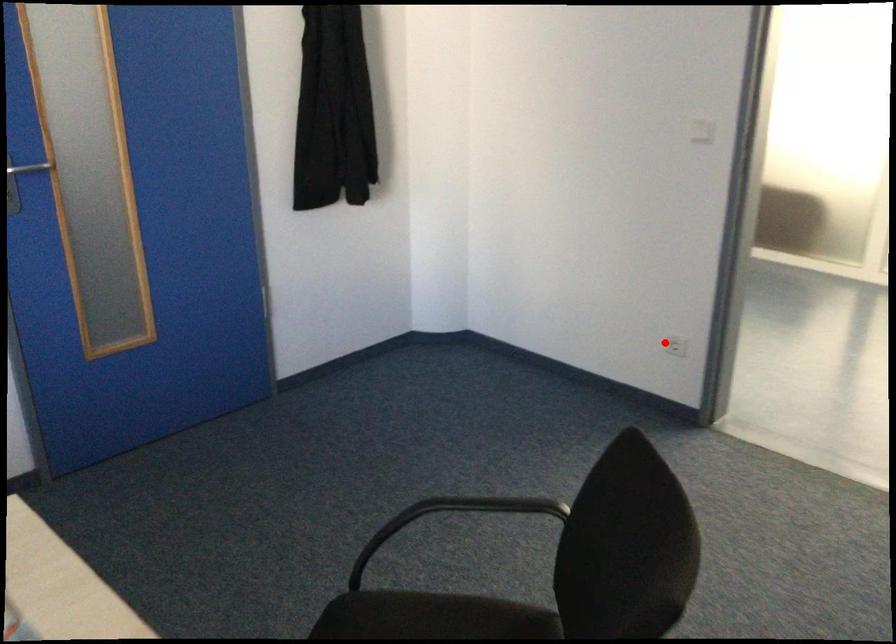
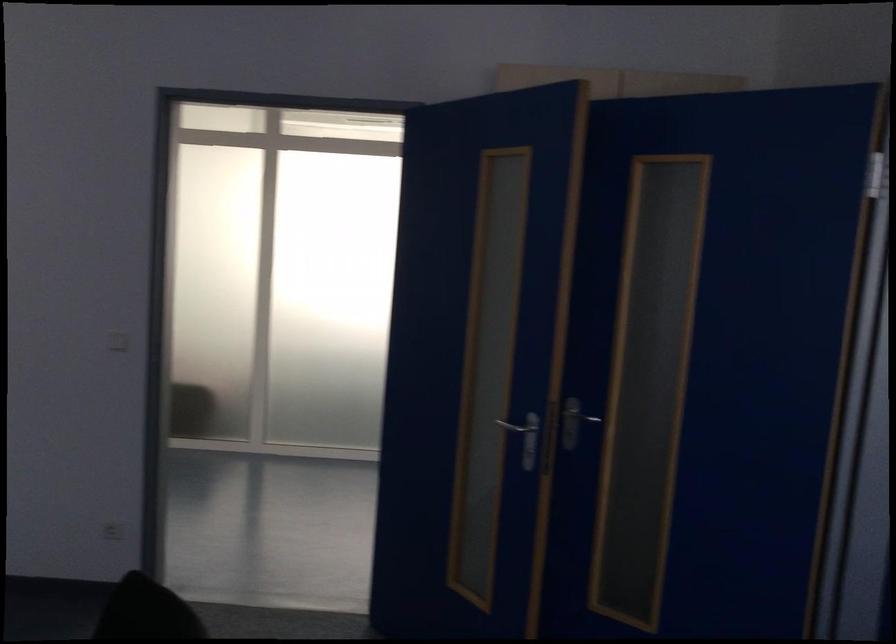
The point at the highlighted location is marked in the first image. Where is the corresponding point in the second image?

(112, 531)